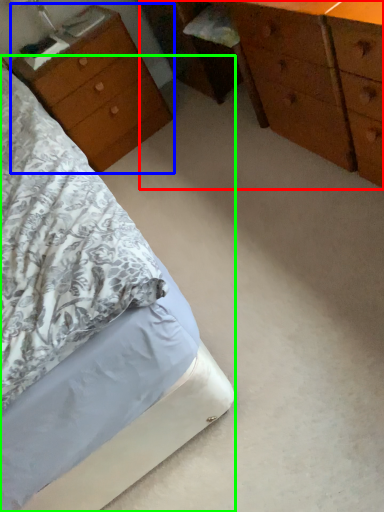
Question: Which is nearer to the chest of drawers (highlighted by a red box)? nightstand (highlighted by a blue box) or bed (highlighted by a green box).

Choices:
 (A) nightstand
 (B) bed

Answer: (A)